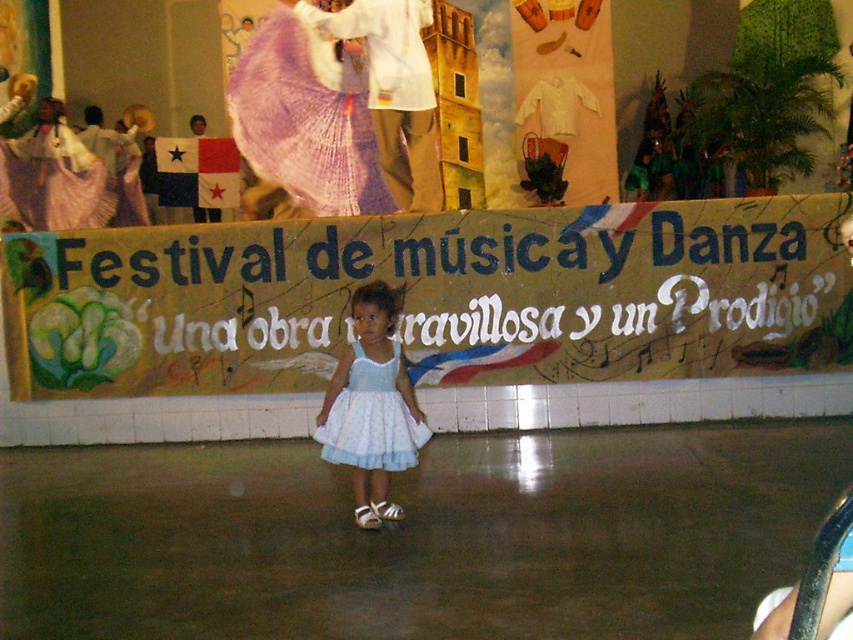
Question: Is yellow paper banner at center to the right of white lace dress at center from the viewer's perspective?

Choices:
 (A) no
 (B) yes

Answer: (A)

Question: Can you confirm if yellow paper banner at center is smaller than white lace dress at center?

Choices:
 (A) no
 (B) yes

Answer: (B)

Question: Which object appears closest to the camera in this image?

Choices:
 (A) yellow paper banner at center
 (B) white lace dress at center

Answer: (B)

Question: Is yellow paper banner at center positioned behind white lace dress at center?

Choices:
 (A) no
 (B) yes

Answer: (B)